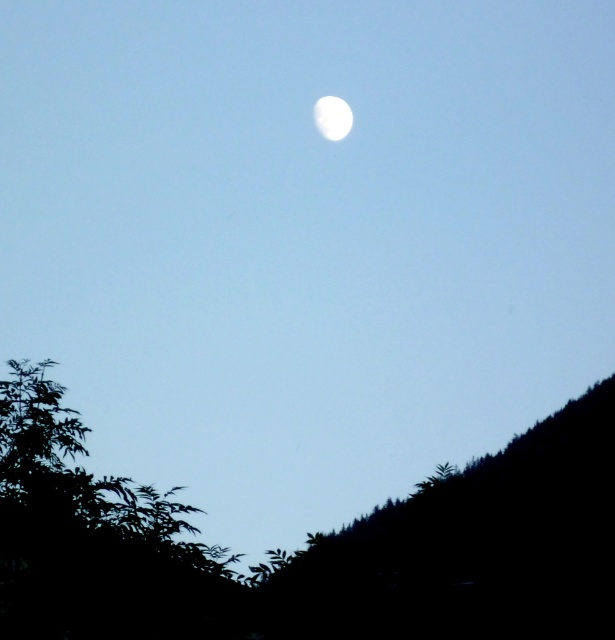
You are an astronomer observing the night sky. You notice the black matte hillside at lower right and the white glossy moon at upper center. Which object occupies a greater area in the image?

The black matte hillside at lower right is larger in size than the white glossy moon at upper center, so it occupies a greater area in the image.

You are an astronaut on a spacewalk and looking down at the Earth. You see the black matte hillside at lower right and the green leafy tree at lower left. Which object is closer to the bottom edge of your view?

The black matte hillside at lower right is positioned under the green leafy tree at lower left, so it is closer to the bottom edge of your view.

You are standing in the forest looking up at the night sky. You see the green leafy tree at lower left and the white glossy moon at upper center. Which object is closer to your left side?

The green leafy tree at lower left is closer to your left side because it is positioned on the left side of the white glossy moon at upper center.